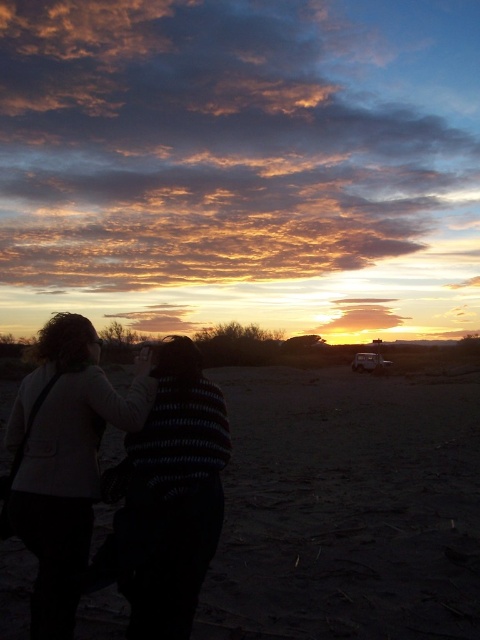
Question: Among these points, which one is nearest to the camera?

Choices:
 (A) (186, 561)
 (B) (312, 387)
 (C) (75, 417)

Answer: (A)

Question: Which object is the farthest from the dark sand at lower center?

Choices:
 (A) striped sweater at center
 (B) striped sweater at lower center

Answer: (B)

Question: Does striped sweater at lower center lie in front of striped sweater at center?

Choices:
 (A) no
 (B) yes

Answer: (A)

Question: Is dark sand at lower center to the left of striped sweater at lower center from the viewer's perspective?

Choices:
 (A) yes
 (B) no

Answer: (A)

Question: Which point is farther from the camera taking this photo?

Choices:
 (A) (83, 424)
 (B) (168, 451)
 (C) (7, 406)

Answer: (C)

Question: Is dark sand at lower center below striped sweater at lower center?

Choices:
 (A) yes
 (B) no

Answer: (A)